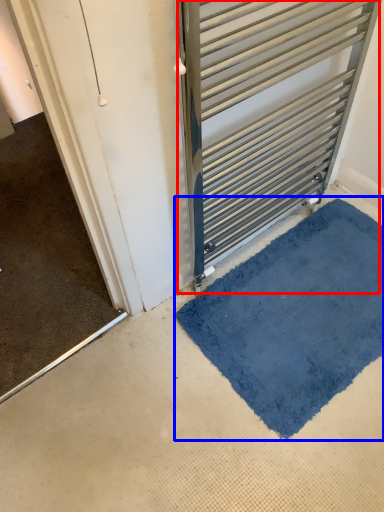
Question: Which object appears farthest to the camera in this image, door (highlighted by a red box) or bath mat (highlighted by a blue box)?

Choices:
 (A) door
 (B) bath mat

Answer: (B)